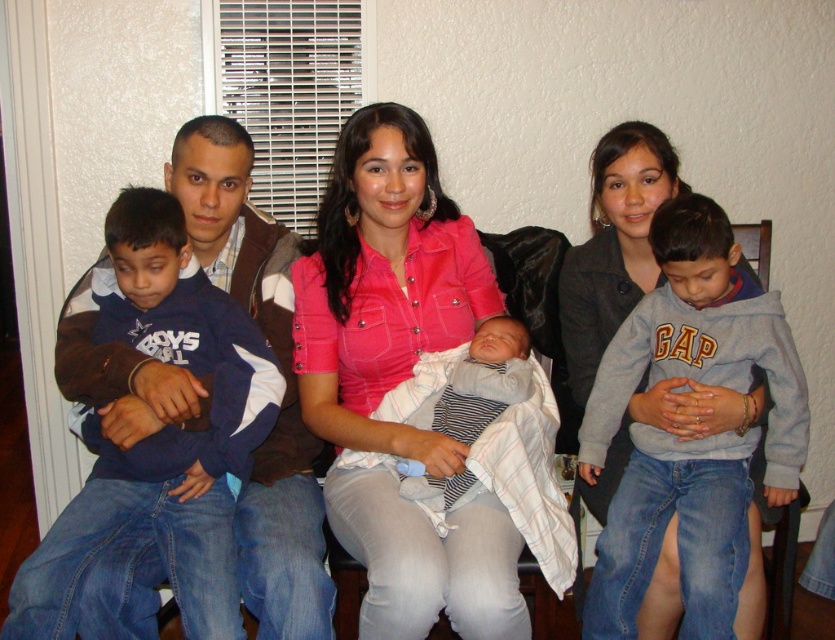
You are organizing a clothing donation drive and need to categorize items by size. You have two items in front of you, the pink denim shirt at center and the striped knit sweater at center. Which one should you place in the large size bin?

The pink denim shirt at center has a larger size compared to striped knit sweater at center, so it should be placed in the large size bin.

Looking at this image, you are standing in the living room and see the pink fabric shirt at center and the striped knit sweater at center. Which one is closer to you?

The pink fabric shirt at center is closer to you because it is further to the viewer than the striped knit sweater at center.

You are a photographer setting up for a family portrait. The pink denim shirt at center and the striped knit sweater at center are both in the center of the frame. If your camera has a depth of field that can focus on objects within a 5 inch range, will both items be in focus?

The distance between the pink denim shirt at center and striped knit sweater at center is 5.84 inches, which exceeds the 5 inch range of the camera. Therefore, both items cannot be in focus simultaneously.